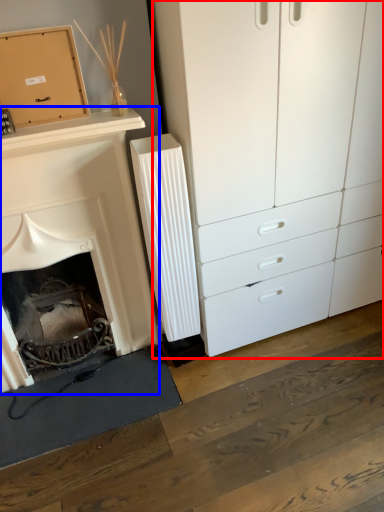
Question: Which object appears closest to the camera in this image, chest of drawers (highlighted by a red box) or fireplace (highlighted by a blue box)?

Choices:
 (A) chest of drawers
 (B) fireplace

Answer: (A)